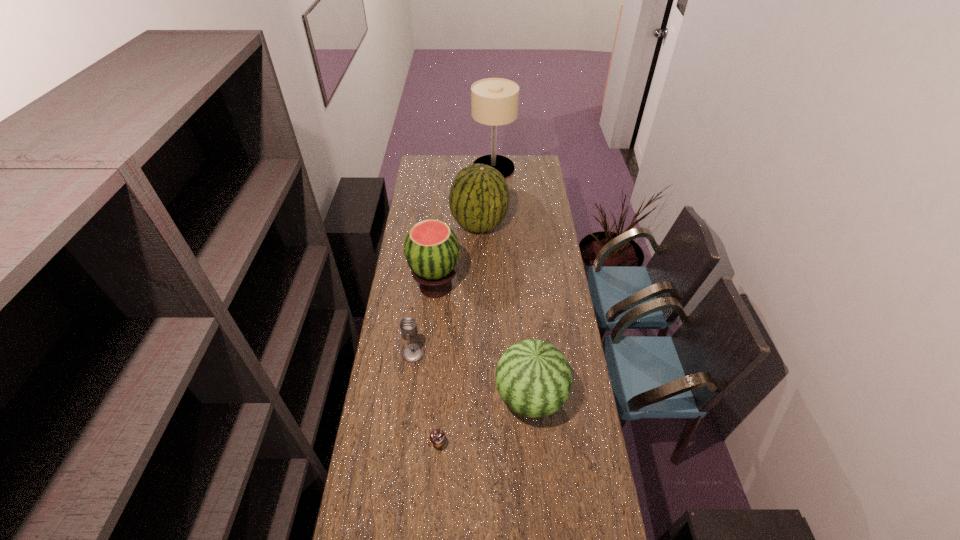
Find the location of a particular element. This screenshot has height=540, width=960. the farthest object is located at coordinates (494, 101).

The image size is (960, 540). I want to click on table lamp, so [494, 101].

The width and height of the screenshot is (960, 540). Identify the location of the second farthest object. (479, 197).

Find the location of a particular element. the third farthest object is located at coordinates (431, 248).

Locate an element on the screen. the second nearest object is located at coordinates (533, 377).

Where is `the fourth farthest object`? the fourth farthest object is located at coordinates (412, 352).

Where is `microphone`? Image resolution: width=960 pixels, height=540 pixels. microphone is located at coordinates (412, 352).

What are the coordinates of `icecream` in the screenshot? It's located at (437, 436).

Locate an element on the screen. This screenshot has height=540, width=960. the shortest object is located at coordinates (437, 436).

Where is `free space located on the front of the tallest object`? The height and width of the screenshot is (540, 960). free space located on the front of the tallest object is located at coordinates (494, 206).